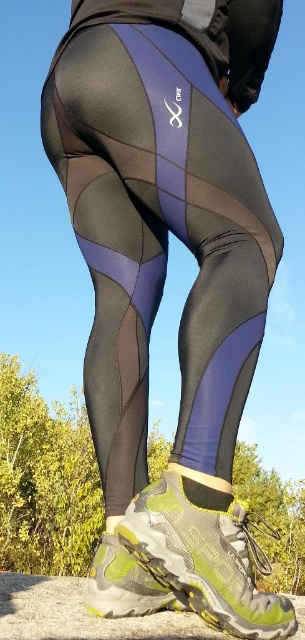
Can you confirm if matte black leggings at center is smaller than matte green and yellow hiking boot at lower center?

No.

Between point (43, 138) and point (143, 600), which one is positioned in front?

Point (143, 600) is more forward.

Does point (136, 285) come closer to viewer compared to point (112, 598)?

That is False.

Image resolution: width=305 pixels, height=640 pixels. Find the location of `matte black leggings at center`. matte black leggings at center is located at coordinates (160, 240).

Is green mesh running shoe at lower center taller than matte green and yellow hiking boot at lower center?

Yes, green mesh running shoe at lower center is taller than matte green and yellow hiking boot at lower center.

Which of these two, green mesh running shoe at lower center or matte green and yellow hiking boot at lower center, stands shorter?

matte green and yellow hiking boot at lower center is shorter.

Identify the location of green mesh running shoe at lower center. The width and height of the screenshot is (305, 640). (204, 556).

The image size is (305, 640). I want to click on green mesh running shoe at lower center, so click(204, 556).

Is point (197, 144) positioned in front of point (230, 506)?

No, it is not.

The width and height of the screenshot is (305, 640). I want to click on matte black leggings at center, so click(x=160, y=240).